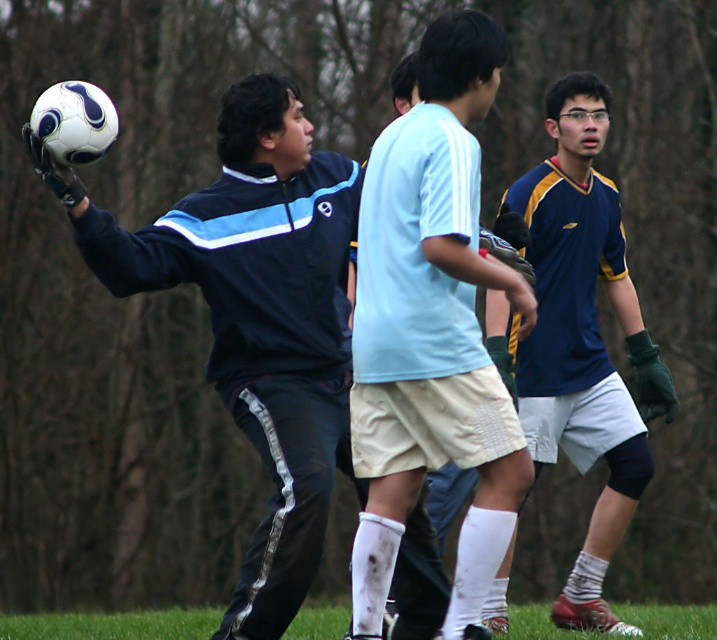
Which is above, matte black jacket at center or blue jersey at right?

Positioned higher is matte black jacket at center.

Who is more distant from viewer, (272, 465) or (574, 275)?

Point (574, 275)

Between point (237, 259) and point (589, 376), which one is positioned behind?

The point (589, 376) is behind.

What are the coordinates of `matte black jacket at center` in the screenshot? It's located at (257, 316).

Does light blue jersey at center have a greater height compared to green grass at lower center?

Yes.

Which is behind, point (381, 288) or point (664, 616)?

The point (664, 616) is behind.

I want to click on light blue jersey at center, so tap(432, 332).

Based on the photo, who is taller, light blue jersey at center or blue jersey at right?

blue jersey at right

Between light blue jersey at center and blue jersey at right, which one appears on the left side from the viewer's perspective?

light blue jersey at center

Between point (508, 419) and point (531, 186), which one is positioned behind?

The point (531, 186) is more distant.

Find the location of a particular element. light blue jersey at center is located at coordinates (432, 332).